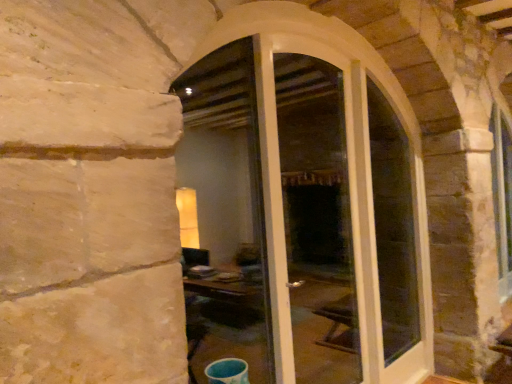
Question: Is the position of white glass door at center more distant than that of white glossy screen door at center?

Choices:
 (A) yes
 (B) no

Answer: (B)

Question: From the image's perspective, does white glass door at center appear lower than white glossy screen door at center?

Choices:
 (A) yes
 (B) no

Answer: (A)

Question: Is white glass door at center taller than white glossy screen door at center?

Choices:
 (A) no
 (B) yes

Answer: (B)

Question: Would you say white glass door at center is a long distance from white glossy screen door at center?

Choices:
 (A) yes
 (B) no

Answer: (A)

Question: Can you confirm if white glass door at center is bigger than white glossy screen door at center?

Choices:
 (A) no
 (B) yes

Answer: (B)

Question: From a real-world perspective, does white glass door at center stand above white glossy screen door at center?

Choices:
 (A) yes
 (B) no

Answer: (B)

Question: Does white glass door at center have a lesser height compared to clear glass door at center?

Choices:
 (A) no
 (B) yes

Answer: (A)

Question: Is clear glass door at center inside white glass door at center?

Choices:
 (A) no
 (B) yes

Answer: (B)

Question: Is white glass door at center next to clear glass door at center?

Choices:
 (A) yes
 (B) no

Answer: (B)

Question: From a real-world perspective, does white glass door at center stand above clear glass door at center?

Choices:
 (A) yes
 (B) no

Answer: (B)

Question: Is clear glass door at center at the back of white glass door at center?

Choices:
 (A) yes
 (B) no

Answer: (A)

Question: Does white glass door at center appear on the right side of clear glass door at center?

Choices:
 (A) yes
 (B) no

Answer: (B)

Question: Is white glossy screen door at center in contact with clear glass door at center?

Choices:
 (A) no
 (B) yes

Answer: (A)